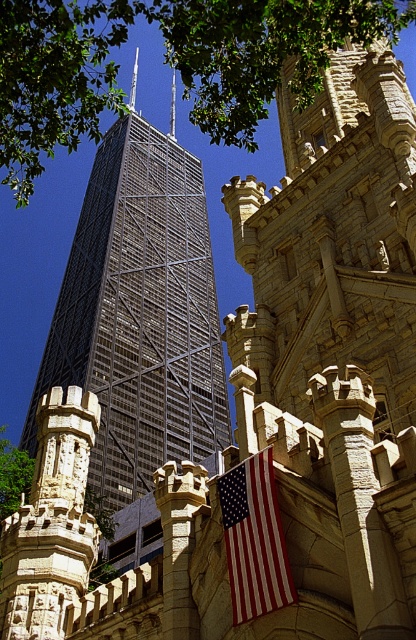
Is red-white striped fabric at center shorter than green leafy tree at lower left?

Yes, red-white striped fabric at center is shorter than green leafy tree at lower left.

Consider the image. Does red-white striped fabric at center have a greater width compared to green leafy tree at lower left?

Incorrect, red-white striped fabric at center's width does not surpass green leafy tree at lower left's.

Does point (265, 483) lie behind point (9, 460)?

No, (265, 483) is in front of (9, 460).

Find the location of `red-white striped fabric at center`. red-white striped fabric at center is located at coordinates (255, 538).

Can you confirm if green leafy tree at upper left is positioned above red-white striped fabric at center?

Yes.

You are a GUI agent. You are given a task and a screenshot of the screen. Output one action in this format:
    pyautogui.click(x=<x>, y=<y>)
    Task: Click on the green leafy tree at upper left
    This screenshot has width=416, height=640.
    Given the screenshot: What is the action you would take?
    pyautogui.click(x=166, y=61)

At what (x,y) coordinates should I click in order to perform the action: click on green leafy tree at upper left. Please return your answer as a coordinate pair (x, y). This screenshot has height=640, width=416. Looking at the image, I should click on pyautogui.click(x=166, y=61).

The height and width of the screenshot is (640, 416). Find the location of `green leafy tree at upper left`. green leafy tree at upper left is located at coordinates (166, 61).

Is metallic glass skyscraper at center below smooth silver spire at center?

Indeed, metallic glass skyscraper at center is positioned under smooth silver spire at center.

Measure the distance between point (116, 500) and camera.

A distance of 92.96 meters exists between point (116, 500) and camera.

At what (x,y) coordinates should I click in order to perform the action: click on metallic glass skyscraper at center. Please return your answer as a coordinate pair (x, y). The width and height of the screenshot is (416, 640). Looking at the image, I should click on (140, 314).